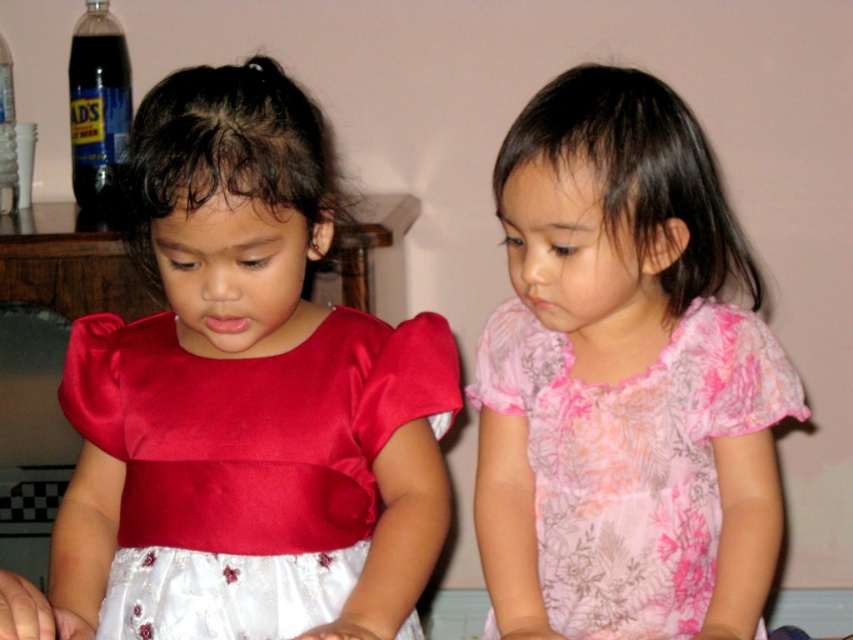
Is satin dress at left to the left of pink floral fabric dress at right from the viewer's perspective?

Indeed, satin dress at left is positioned on the left side of pink floral fabric dress at right.

Is point (325, 371) farther from camera compared to point (485, 380)?

No, it is not.

Between point (320, 621) and point (653, 541), which one is positioned in front?

Point (320, 621)

You are a GUI agent. You are given a task and a screenshot of the screen. Output one action in this format:
    pyautogui.click(x=<x>, y=<y>)
    Task: Click on the satin dress at left
    
    Given the screenshot: What is the action you would take?
    pyautogui.click(x=247, y=465)